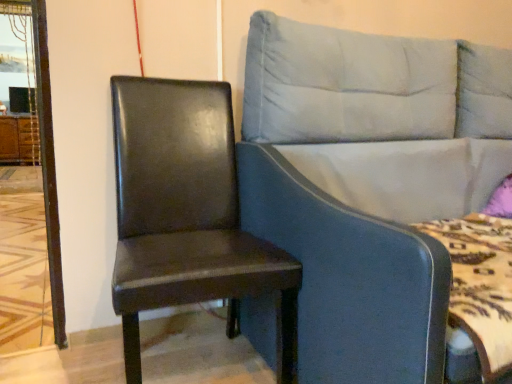
Question: Based on their sizes in the image, would you say light blue fabric studio couch at center is bigger or smaller than matte black chair at left?

Choices:
 (A) big
 (B) small

Answer: (A)

Question: From a real-world perspective, is light blue fabric studio couch at center above or below matte black chair at left?

Choices:
 (A) below
 (B) above

Answer: (B)

Question: Estimate the real-world distances between objects in this image. Which object is closer to the matte black chair at left?

Choices:
 (A) light blue fabric studio couch at center
 (B) brown wood dresser at left

Answer: (A)

Question: Which is nearer to the brown wood dresser at left?

Choices:
 (A) matte black chair at left
 (B) light blue fabric studio couch at center

Answer: (A)